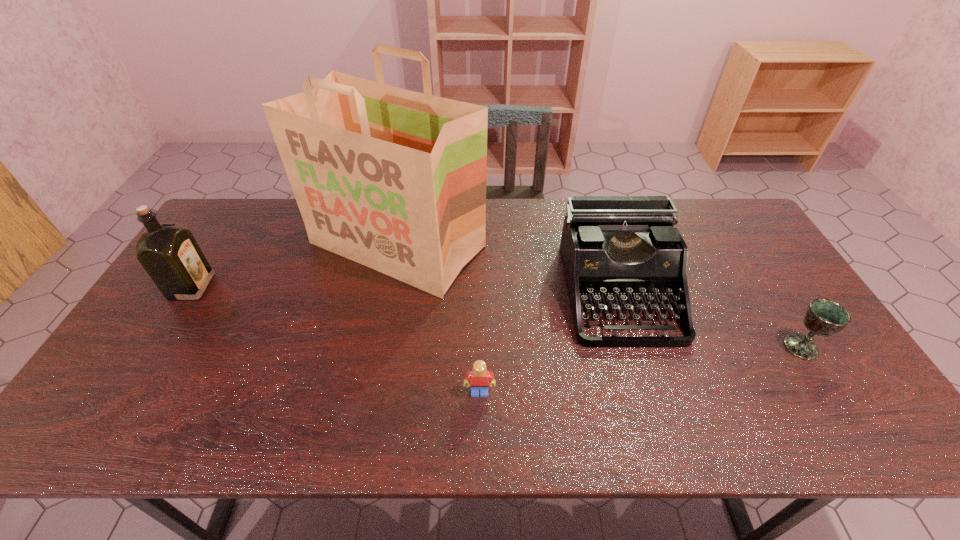
Where is `vacant region at the right edge of the desktop`? The image size is (960, 540). vacant region at the right edge of the desktop is located at coordinates (728, 253).

The image size is (960, 540). I want to click on vacant space at the far right corner of the desktop, so click(716, 240).

You are a GUI agent. You are given a task and a screenshot of the screen. Output one action in this format:
    pyautogui.click(x=<x>, y=<y>)
    Task: Click on the free space at the near right corner
    The width and height of the screenshot is (960, 540).
    Given the screenshot: What is the action you would take?
    pyautogui.click(x=853, y=411)

The image size is (960, 540). Identify the location of blank region between the Lego and the liquor. (336, 340).

The width and height of the screenshot is (960, 540). Identify the location of free space between the leftmost object and the typewriter. (405, 289).

The image size is (960, 540). Find the location of `free point between the rightmost object and the nearest object`. free point between the rightmost object and the nearest object is located at coordinates (640, 370).

Where is `free space between the liquor and the grocery bag`? free space between the liquor and the grocery bag is located at coordinates (295, 266).

I want to click on empty location between the fourth object from left to right and the second tallest object, so click(405, 289).

The height and width of the screenshot is (540, 960). Find the location of `free space between the nearest object and the third tallest object`. free space between the nearest object and the third tallest object is located at coordinates pyautogui.click(x=549, y=342).

Identify the location of free space between the third tallest object and the second shortest object. (709, 320).